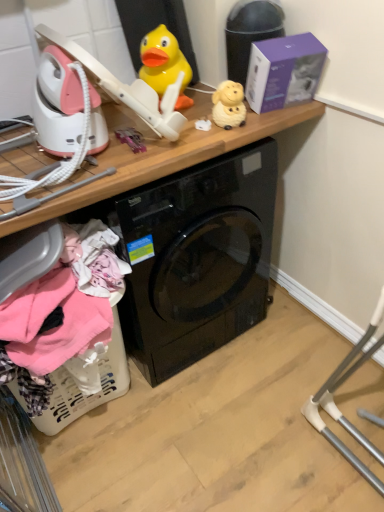
Question: Relative to yellow rubber duck at upper center, the second toy positioned from the right, is purple matte box at upper right in front or behind?

Choices:
 (A) behind
 (B) front

Answer: (B)

Question: Considering the positions of purple matte box at upper right and yellow rubber duck at upper center, the second toy positioned from the right, in the image, is purple matte box at upper right bigger or smaller than yellow rubber duck at upper center, the second toy positioned from the right,?

Choices:
 (A) small
 (B) big

Answer: (B)

Question: Estimate the real-world distances between objects in this image. Which object is farther from the yellow rubber duck at upper center, the first toy viewed from the left?

Choices:
 (A) matte yellow sheep at upper center, placed as the 2th toy when sorted from left to right
 (B) wooden at upper center
 (C) white plastic laundry basket at lower left
 (D) purple matte box at upper right

Answer: (C)

Question: Estimate the real-world distances between objects in this image. Which object is farther from the wooden at upper center?

Choices:
 (A) matte yellow sheep at upper center, placed as the 2th toy when sorted from left to right
 (B) purple matte box at upper right
 (C) yellow rubber duck at upper center, the first toy viewed from the left
 (D) white plastic laundry basket at lower left

Answer: (D)